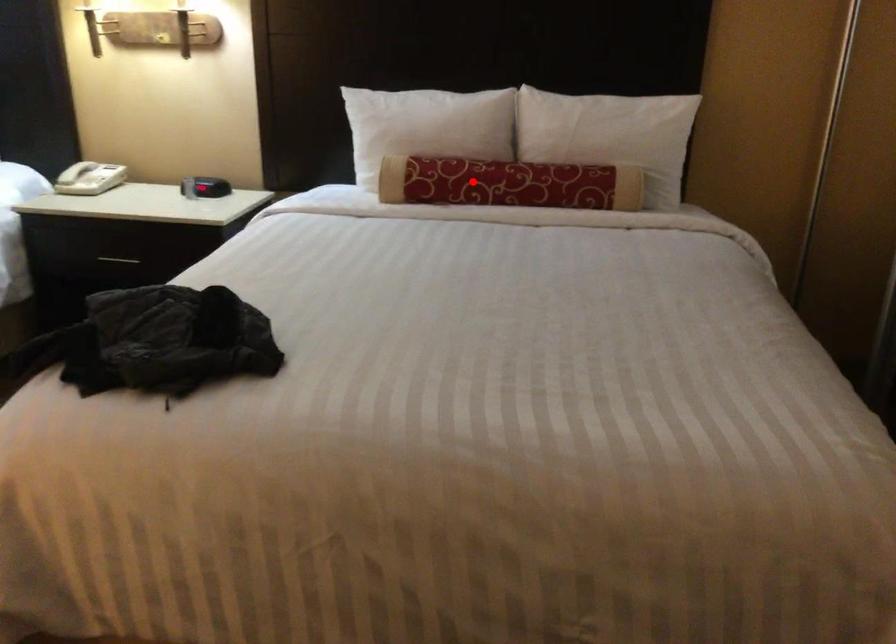
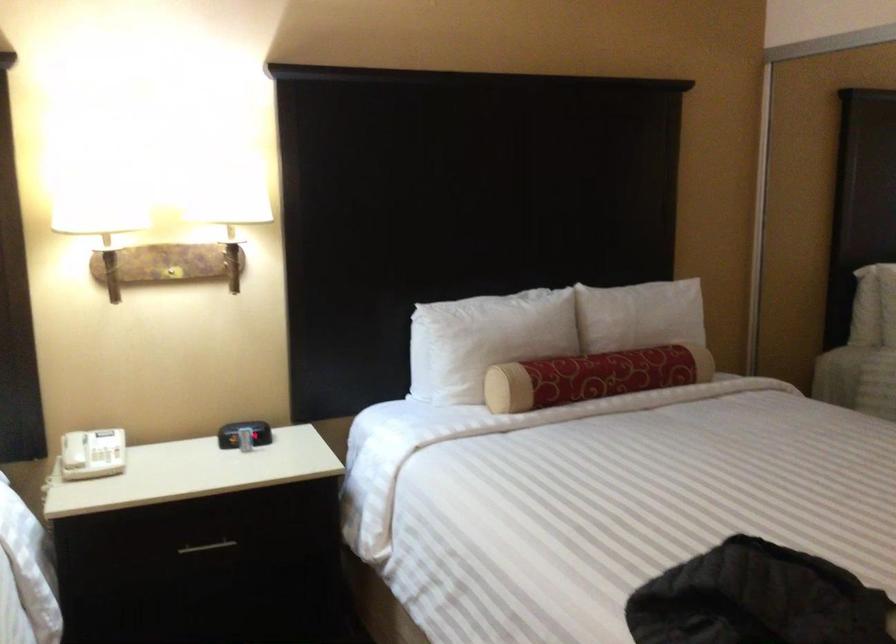
Where in the second image is the point corresponding to the highlighted location from the first image?

(592, 377)